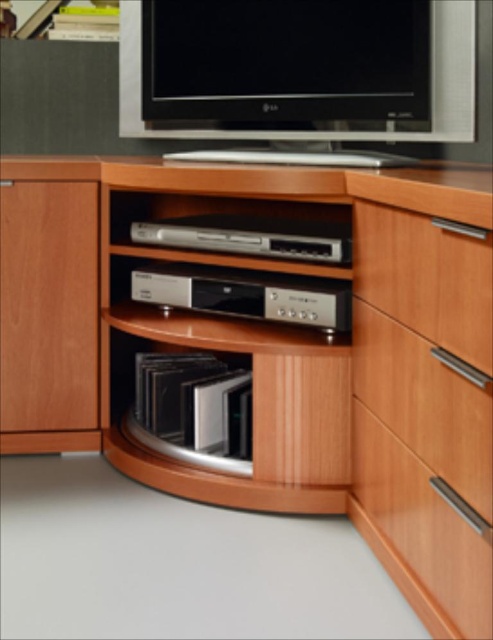
Between point (428, 406) and point (153, 408), which one is positioned behind?

Positioned behind is point (153, 408).

Does point (359, 321) come closer to viewer compared to point (147, 368)?

Yes.

Where is `wooden drawer at center`? wooden drawer at center is located at coordinates (426, 403).

Is wooden drawer at center further to the viewer compared to silver metallic dvd player at center?

No, it is not.

Is wooden drawer at center positioned before silver metallic dvd player at center?

Yes, wooden drawer at center is in front of silver metallic dvd player at center.

Does point (430, 371) come behind point (173, 276)?

That is False.

Where is `wooden drawer at center`? wooden drawer at center is located at coordinates (426, 403).

Looking at this image, is satin silver dvd player at center smaller than satin black vinyl records at lower center?

No.

Does satin silver dvd player at center appear on the left side of satin black vinyl records at lower center?

In fact, satin silver dvd player at center is to the right of satin black vinyl records at lower center.

Image resolution: width=493 pixels, height=640 pixels. In order to click on satin silver dvd player at center in this screenshot , I will do `click(249, 236)`.

I want to click on satin silver dvd player at center, so click(x=249, y=236).